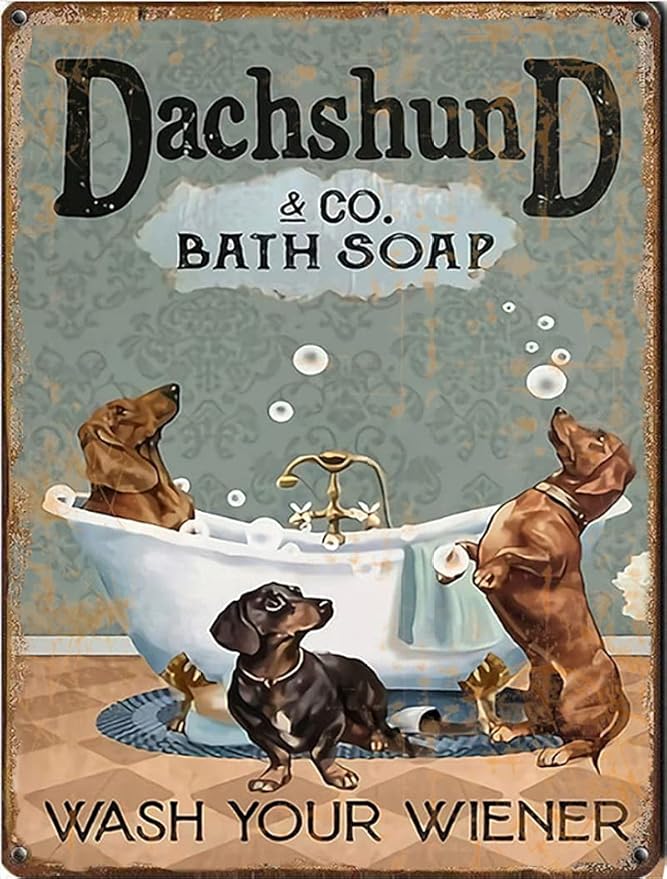
I want to click on slipper, so click(428, 716).